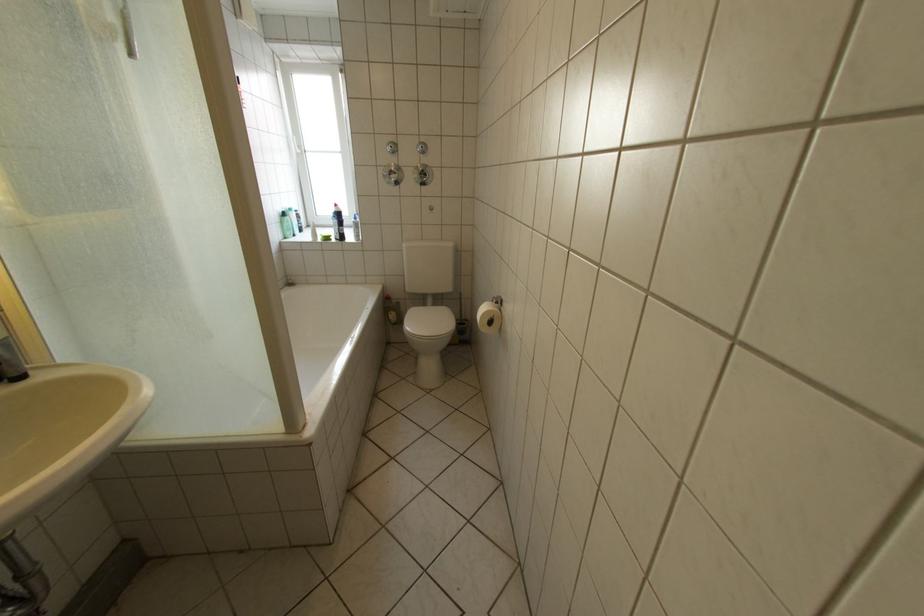
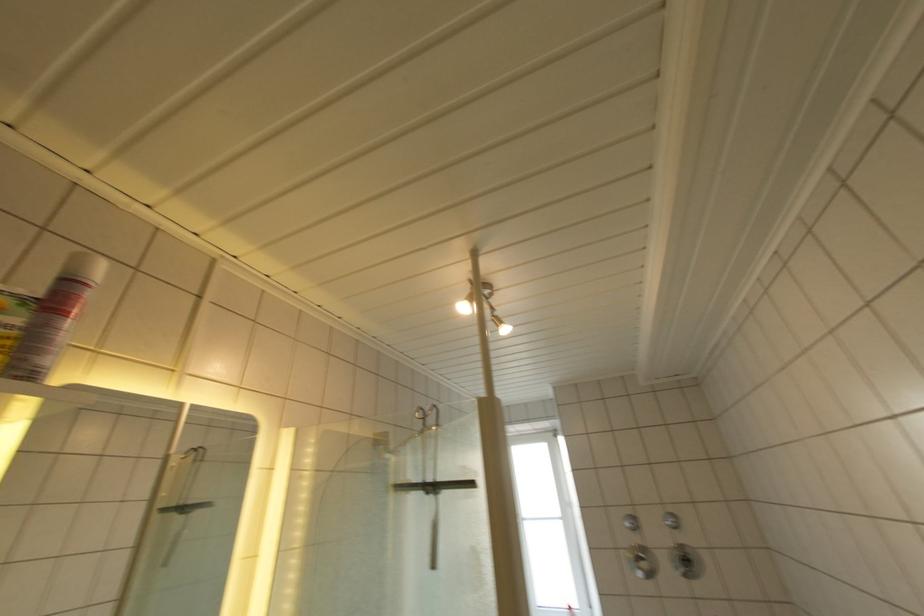
The images are taken continuously from a first-person perspective. In which direction is your viewpoint rotating?

The camera rotated toward left-up.